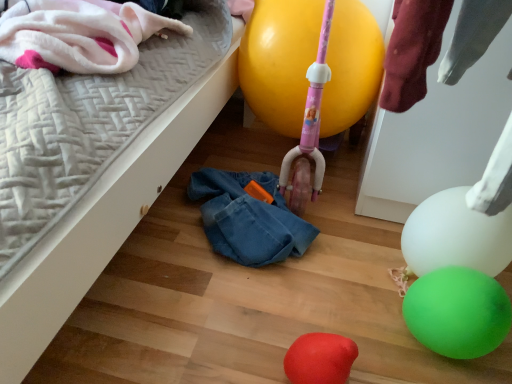
Question: Which direction should I rotate to face rubber balloon at lower center, which is the fourth balloon from top to bottom, — up or down?

Choices:
 (A) up
 (B) down

Answer: (B)

Question: Is green rubber balloon at lower right, the third balloon in the top-to-bottom sequence, located within fluffy white blanket at upper left?

Choices:
 (A) yes
 (B) no

Answer: (B)

Question: Does fluffy white blanket at upper left lie in front of green rubber balloon at lower right, the 2th balloon from the bottom?

Choices:
 (A) yes
 (B) no

Answer: (B)

Question: From the image's perspective, is fluffy white blanket at upper left below green rubber balloon at lower right, the 2th balloon from the bottom?

Choices:
 (A) no
 (B) yes

Answer: (A)

Question: Does fluffy white blanket at upper left have a lesser height compared to green rubber balloon at lower right, the third balloon in the top-to-bottom sequence?

Choices:
 (A) no
 (B) yes

Answer: (B)

Question: Is fluffy white blanket at upper left at the right side of green rubber balloon at lower right, the third balloon in the top-to-bottom sequence?

Choices:
 (A) yes
 (B) no

Answer: (B)

Question: From a real-world perspective, is fluffy white blanket at upper left located beneath green rubber balloon at lower right, the 2th balloon from the bottom?

Choices:
 (A) no
 (B) yes

Answer: (A)

Question: Could you tell me if fluffy white blanket at upper left is facing white glossy balloon at lower right, the third balloon positioned from the bottom?

Choices:
 (A) no
 (B) yes

Answer: (A)

Question: From the image's perspective, is fluffy white blanket at upper left on top of white glossy balloon at lower right, the third balloon positioned from the bottom?

Choices:
 (A) no
 (B) yes

Answer: (B)

Question: Is fluffy white blanket at upper left to the left of white glossy balloon at lower right, marked as the second balloon in a top-to-bottom arrangement, from the viewer's perspective?

Choices:
 (A) yes
 (B) no

Answer: (A)

Question: Is fluffy white blanket at upper left next to white glossy balloon at lower right, marked as the second balloon in a top-to-bottom arrangement?

Choices:
 (A) yes
 (B) no

Answer: (B)

Question: Is fluffy white blanket at upper left further to camera compared to white glossy balloon at lower right, marked as the second balloon in a top-to-bottom arrangement?

Choices:
 (A) yes
 (B) no

Answer: (B)

Question: Is fluffy white blanket at upper left smaller than white glossy balloon at lower right, the third balloon positioned from the bottom?

Choices:
 (A) no
 (B) yes

Answer: (A)

Question: Can yellow rubber balloon at center, the 1th balloon viewed from the top, be found inside green rubber balloon at lower right, the third balloon in the top-to-bottom sequence?

Choices:
 (A) yes
 (B) no

Answer: (B)